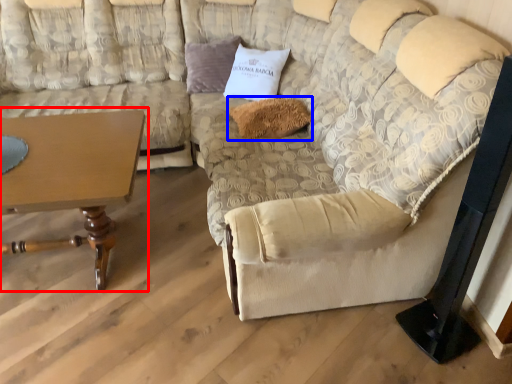
Question: Which point is further to the camera, table (highlighted by a red box) or pillow (highlighted by a blue box)?

Choices:
 (A) table
 (B) pillow

Answer: (B)